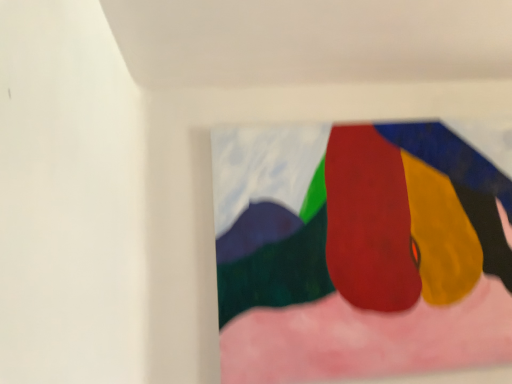
In order to face matte acrylic painting at upper right, should I rotate leftwards or rightwards?

To face it directly, rotate right by 16.538 degrees.

Describe the element at coordinates (358, 252) in the screenshot. I see `matte acrylic painting at upper right` at that location.

Locate an element on the screen. This screenshot has height=384, width=512. matte acrylic painting at upper right is located at coordinates (358, 252).

Find the location of a particular element. Image resolution: width=512 pixels, height=384 pixels. matte acrylic painting at upper right is located at coordinates (358, 252).